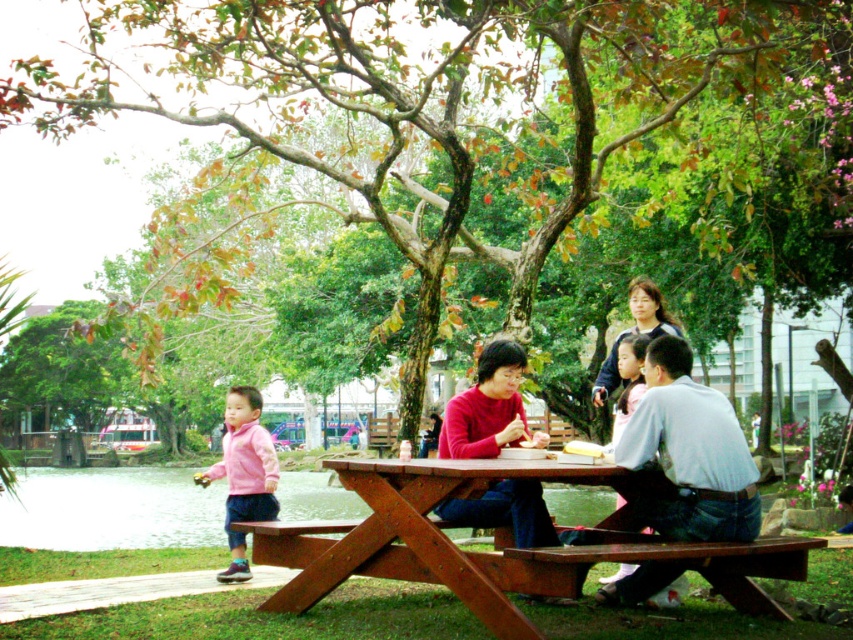
Consider the image. You are a photographer standing at the edge of the park. You want to take a photo of the wooden picnic table at center and the white cotton shirt at center. Based on their positions, which object should you focus on first to ensure both are in the frame?

The wooden picnic table at center is located above the white cotton shirt at center, so you should focus on the wooden picnic table at center first to ensure both are in the frame.

You are standing at the picnic table in the park scene. You need to locate the white cotton shirt at center. According to the coordinates provided, where would you look relative to the picnic table?

The white cotton shirt at center is located at coordinates point 0.706 on the x axis and 0.811 on the y axis relative to the picnic table.

You are a park visitor who wants to place a 7 feet long picnic blanket on the ground between the wooden picnic table at center and the pink fleece jacket at lower left. Can you fit the blanket there?

The distance between the wooden picnic table at center and the pink fleece jacket at lower left is 6.97 feet, which is slightly shorter than the 7 feet long picnic blanket. Therefore, the blanket might not fit entirely between them.